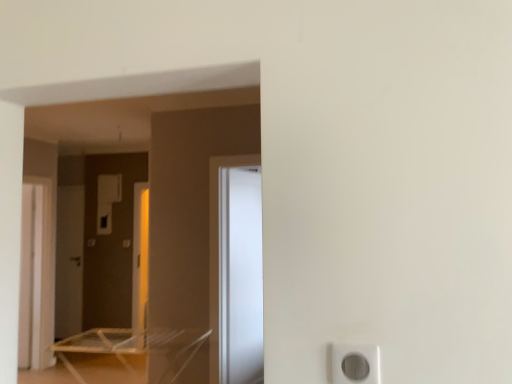
Question: Can you confirm if clear plastic table at lower left is smaller than white plastic screen door at left, placed as the 2th screen door when sorted from front to back?

Choices:
 (A) no
 (B) yes

Answer: (A)

Question: From the image's perspective, is clear plastic table at lower left beneath white plastic screen door at left, positioned as the 2th screen door in right-to-left order?

Choices:
 (A) no
 (B) yes

Answer: (B)

Question: Can you confirm if clear plastic table at lower left is positioned to the left of white plastic screen door at left, placed as the 2th screen door when sorted from left to right?

Choices:
 (A) yes
 (B) no

Answer: (B)

Question: Is clear plastic table at lower left taller than white plastic screen door at left, positioned as the 2th screen door in right-to-left order?

Choices:
 (A) no
 (B) yes

Answer: (A)

Question: From the image's perspective, is clear plastic table at lower left over white plastic screen door at left, positioned as the 2th screen door in right-to-left order?

Choices:
 (A) yes
 (B) no

Answer: (B)

Question: Considering the relative positions of clear plastic table at lower left and white plastic screen door at left, placed as the 2th screen door when sorted from front to back, in the image provided, is clear plastic table at lower left behind white plastic screen door at left, placed as the 2th screen door when sorted from front to back,?

Choices:
 (A) no
 (B) yes

Answer: (A)

Question: From the image's perspective, is white plastic screen door at left, placed as the 2th screen door when sorted from left to right, below clear plastic table at lower left?

Choices:
 (A) yes
 (B) no

Answer: (B)

Question: Is white plastic screen door at left, positioned as the 2th screen door in right-to-left order, not close to clear plastic table at lower left?

Choices:
 (A) no
 (B) yes

Answer: (A)

Question: Considering the relative sizes of white plastic screen door at left, positioned as the 2th screen door in right-to-left order, and clear plastic table at lower left in the image provided, is white plastic screen door at left, positioned as the 2th screen door in right-to-left order, thinner than clear plastic table at lower left?

Choices:
 (A) yes
 (B) no

Answer: (A)

Question: Does white plastic screen door at left, positioned as the 2th screen door in right-to-left order, have a greater width compared to clear plastic table at lower left?

Choices:
 (A) yes
 (B) no

Answer: (B)

Question: Is white plastic screen door at left, positioned as the 2th screen door in right-to-left order, taller than clear plastic table at lower left?

Choices:
 (A) no
 (B) yes

Answer: (B)

Question: Can you confirm if white plastic screen door at left, acting as the 2th screen door starting from the back, is positioned to the left of clear plastic table at lower left?

Choices:
 (A) yes
 (B) no

Answer: (A)

Question: Is clear plastic table at lower left to the left of white glossy screen door at center, marked as the 3th screen door in a left-to-right arrangement, from the viewer's perspective?

Choices:
 (A) no
 (B) yes

Answer: (B)